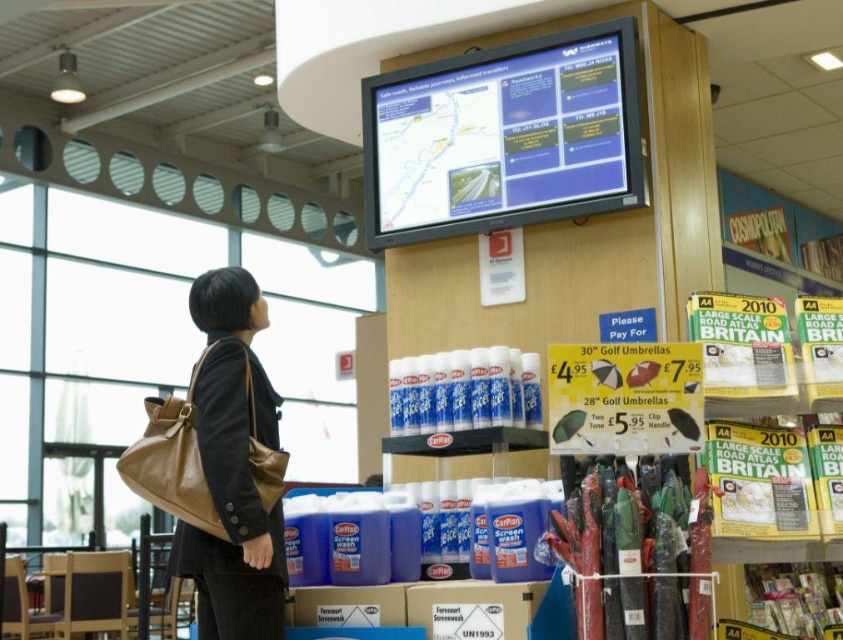
You are a store employee and you need to retrieve a customer item from the brown leather bag at lower left and the brown leather bag at left. Which bag is positioned higher up in the image?

The brown leather bag at lower left is located above the brown leather bag at left, so the one at lower left is positioned higher up.

You are a store employee who needs to retrieve a customer service manual from the shelf behind the brown leather bag at lower left and the brown leather bag at left. Which bag should you move first to access the shelf?

The brown leather bag at left should be moved first because it is positioned to the left of the brown leather bag at lower left, meaning it is closer to the shelf and blocking access more directly.

You are a customer in the store and you want to know where your bag is. You see the point at (234, 468). Is your bag located at that point?

Yes, the brown leather bag at lower left is located at point (234, 468).